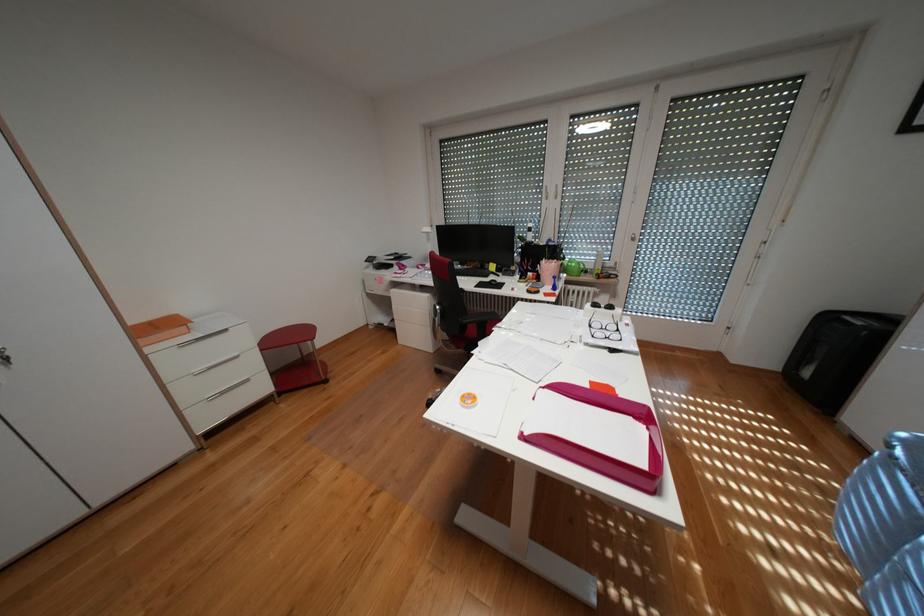
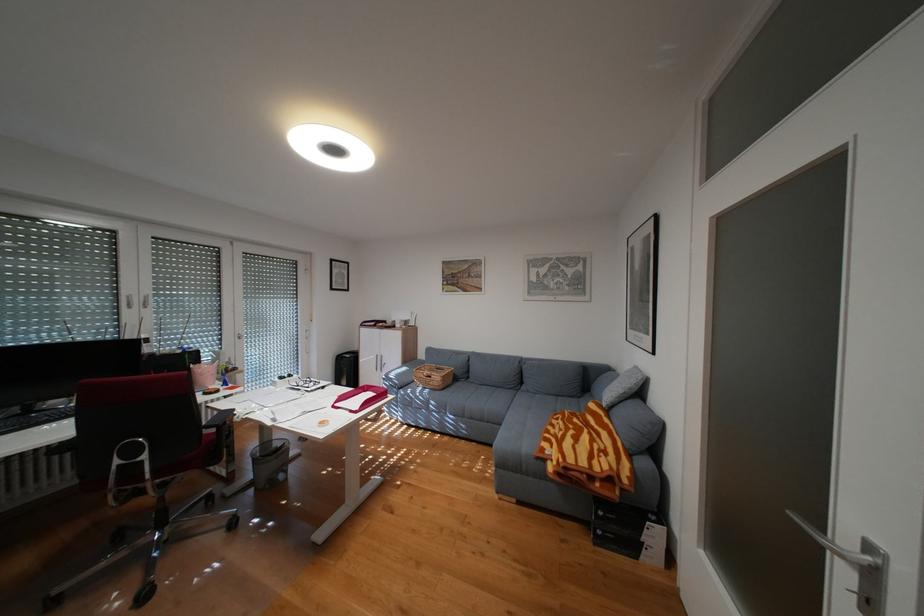
Where in the second image is the point corresponding to pixel 612 306 from the first image?

(297, 377)